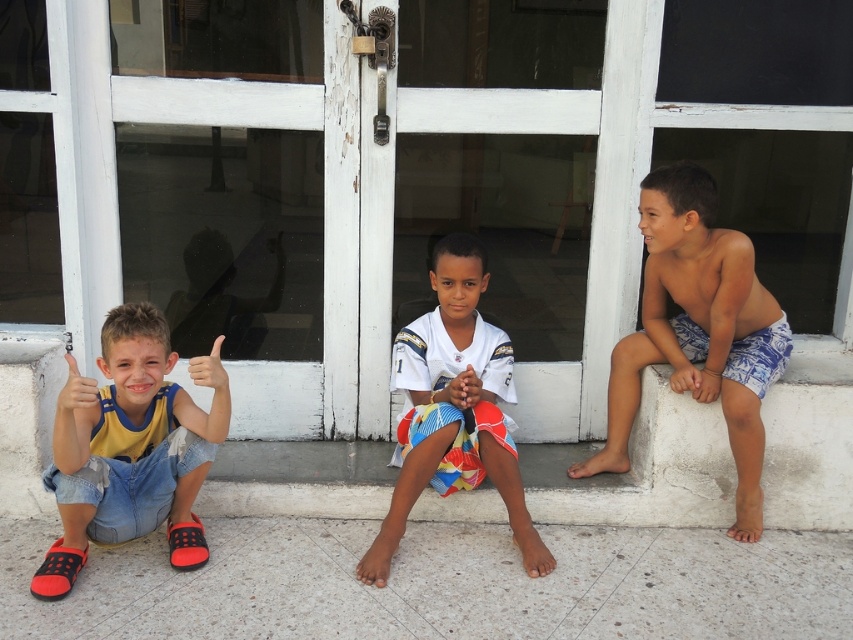
Does blue printed shorts at right appear on the right side of white jersey at center?

Yes, blue printed shorts at right is to the right of white jersey at center.

Does blue printed shorts at right have a smaller size compared to white jersey at center?

No, blue printed shorts at right is not smaller than white jersey at center.

The width and height of the screenshot is (853, 640). Find the location of `blue printed shorts at right`. blue printed shorts at right is located at coordinates (698, 330).

Is denim shorts at left bigger than white jersey at center?

Indeed, denim shorts at left has a larger size compared to white jersey at center.

Between denim shorts at left and white jersey at center, which one appears on the left side from the viewer's perspective?

From the viewer's perspective, denim shorts at left appears more on the left side.

Is point (67, 556) closer to camera compared to point (520, 488)?

Yes, point (67, 556) is in front of point (520, 488).

The height and width of the screenshot is (640, 853). Find the location of `denim shorts at left`. denim shorts at left is located at coordinates (131, 448).

This screenshot has height=640, width=853. Identify the location of blue printed shorts at right. (698, 330).

You are a GUI agent. You are given a task and a screenshot of the screen. Output one action in this format:
    pyautogui.click(x=<x>, y=<y>)
    Task: Click on the blue printed shorts at right
    The image size is (853, 640).
    Given the screenshot: What is the action you would take?
    pos(698,330)